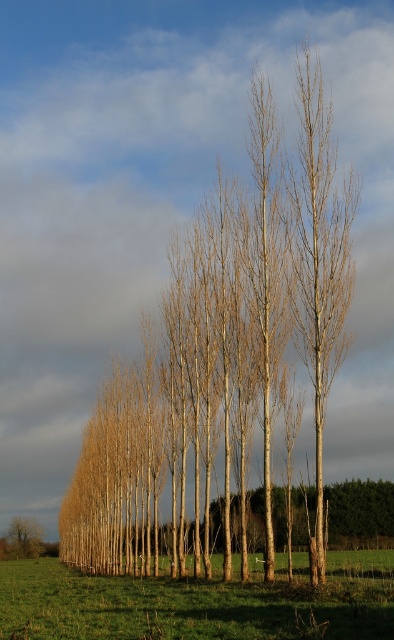
Can you confirm if smooth brown tree at center is positioned to the left of brown smooth tree at lower left?

No, smooth brown tree at center is not to the left of brown smooth tree at lower left.

Find the location of a particular element. The width and height of the screenshot is (394, 640). smooth brown tree at center is located at coordinates (226, 352).

What are the coordinates of `smooth brown tree at center` in the screenshot? It's located at (226, 352).

Can you confirm if green grass at lower left is shorter than smooth light brown birch tree at center?

Indeed, green grass at lower left has a lesser height compared to smooth light brown birch tree at center.

Where is `green grass at lower left`? Image resolution: width=394 pixels, height=640 pixels. green grass at lower left is located at coordinates (193, 604).

Which is more to the right, green grass at lower left or brown smooth tree at lower left?

green grass at lower left

Who is more distant from viewer, (x=53, y=620) or (x=18, y=522)?

Point (x=18, y=522)

Is point (189, 627) in front of point (14, 532)?

Yes.

In order to click on green grass at lower left in this screenshot , I will do `click(193, 604)`.